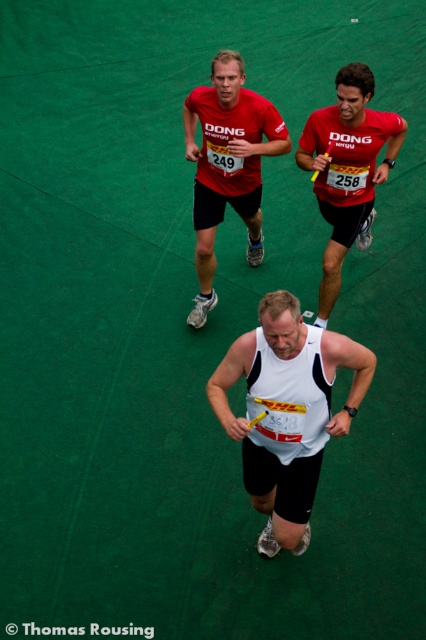
From the picture: Which is below, matte red shirt at upper center or red matte jersey at upper right?

red matte jersey at upper right is below.

Does matte red shirt at upper center appear under red matte jersey at upper right?

No.

Is point (219, 56) behind point (337, 292)?

No, it is not.

In order to click on matte red shirt at upper center in this screenshot , I will do `click(227, 164)`.

Between point (262, 324) and point (230, 108), which one is positioned in front?

Point (262, 324)

Between white matte vest at center and matte red shirt at upper center, which one appears on the left side from the viewer's perspective?

From the viewer's perspective, matte red shirt at upper center appears more on the left side.

Is point (270, 301) less distant than point (190, 147)?

Yes, point (270, 301) is closer to viewer.

Find the location of a particular element. The height and width of the screenshot is (640, 426). white matte vest at center is located at coordinates (287, 412).

Is white matte vest at center below red matte jersey at upper right?

Indeed, white matte vest at center is positioned under red matte jersey at upper right.

Which is more to the left, white matte vest at center or red matte jersey at upper right?

white matte vest at center is more to the left.

Between point (314, 432) and point (322, 164), which one is positioned in front?

Point (314, 432)

Where is `white matte vest at center`? white matte vest at center is located at coordinates (287, 412).